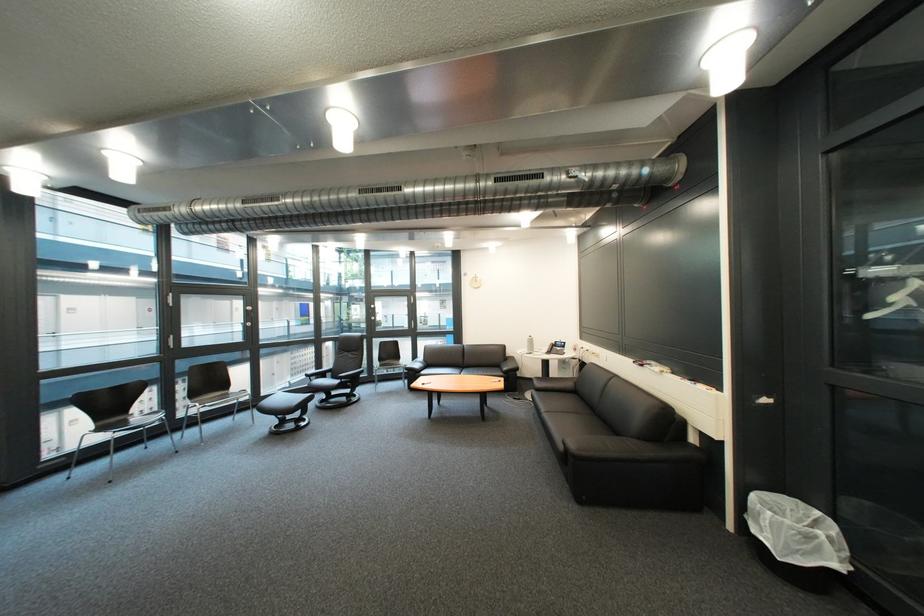
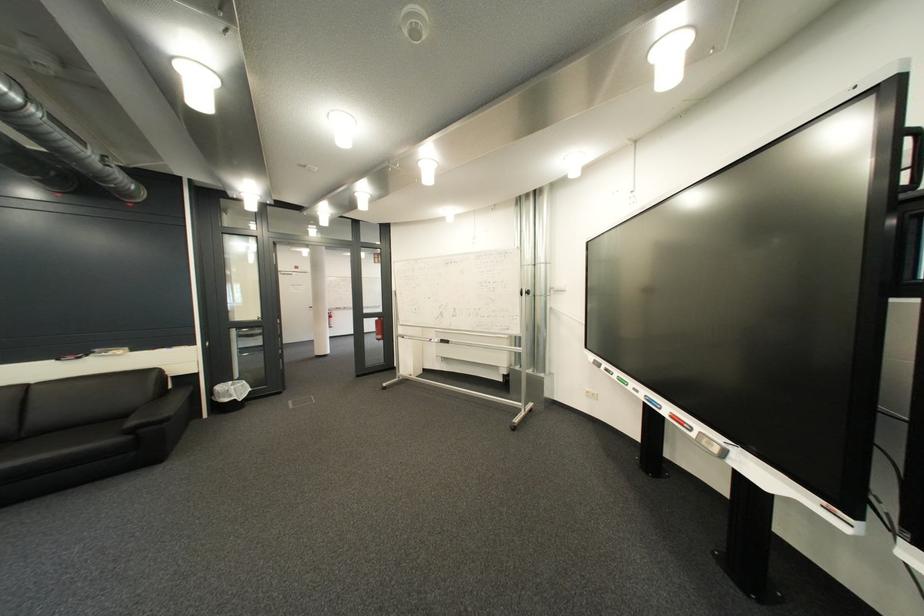
In the second image, find the point that corresponds to (833,515) in the first image.

(245, 384)